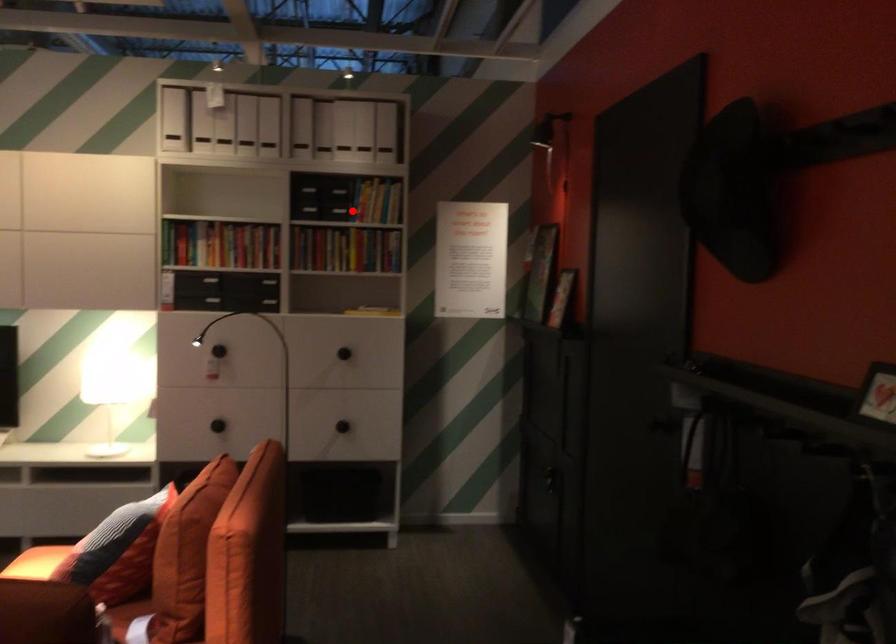
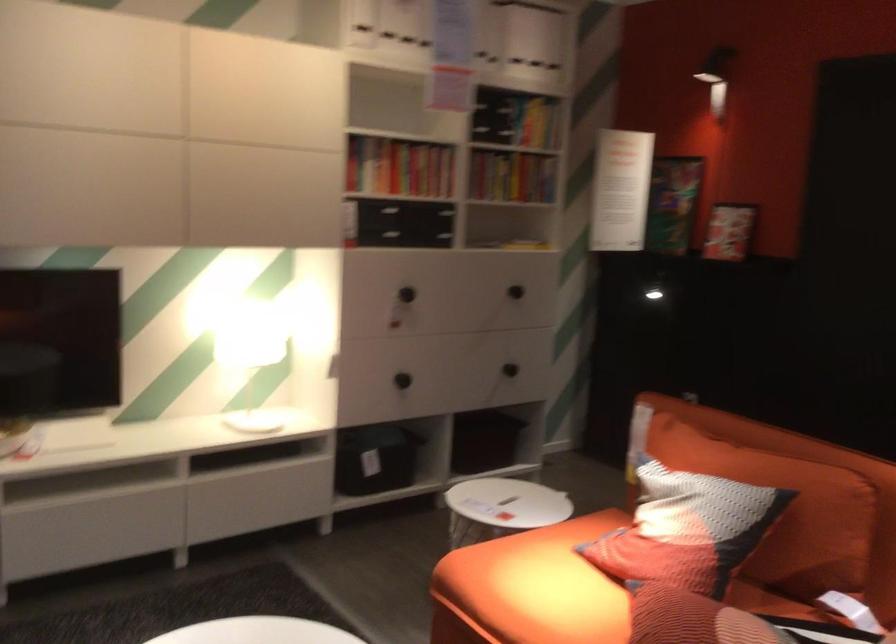
Question: I am providing you with two images of the same scene from different viewpoints. Given a red point in image1, look at the same physical point in image2. Is it:

Choices:
 (A) Closer to the viewpoint
 (B) Farther from the viewpoint

Answer: (A)